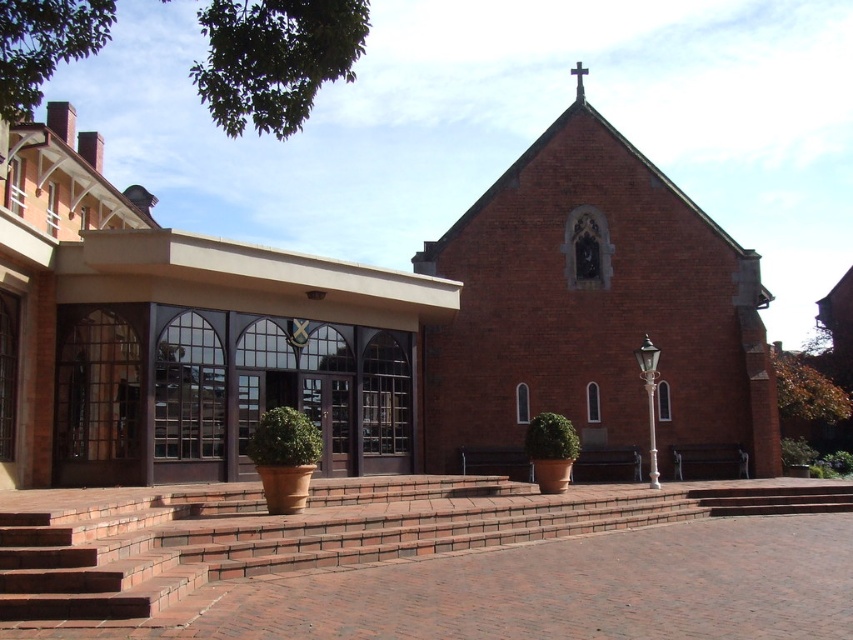
Which is more to the right, brick church at center or brick chapel at center?

Positioned to the right is brick chapel at center.

The width and height of the screenshot is (853, 640). In order to click on brick church at center in this screenshot , I will do `click(367, 323)`.

Locate an element on the screen. brick church at center is located at coordinates (367, 323).

Where is `brick church at center`? Image resolution: width=853 pixels, height=640 pixels. brick church at center is located at coordinates (367, 323).

Does point (473, 280) come in front of point (22, 509)?

No, (473, 280) is further to viewer.

The width and height of the screenshot is (853, 640). I want to click on brick church at center, so click(367, 323).

Measure the distance from brick chapel at center to brick stairs at center.

The distance of brick chapel at center from brick stairs at center is 20.34 meters.

Between point (709, 218) and point (413, 552), which one is positioned in front?

Point (413, 552) is in front.

Between point (556, 205) and point (119, 516), which one is positioned behind?

Point (556, 205)

At what (x,y) coordinates should I click in order to perform the action: click on brick chapel at center. Please return your answer as a coordinate pair (x, y). Image resolution: width=853 pixels, height=640 pixels. Looking at the image, I should click on (596, 307).